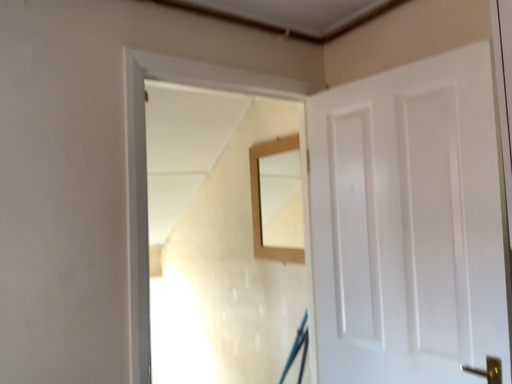
What is the approximate width of wooden frame at center?

The width of wooden frame at center is 5.06 inches.

Image resolution: width=512 pixels, height=384 pixels. I want to click on wooden mirror at center, so click(260, 199).

Find the location of `wooden frame at center`. wooden frame at center is located at coordinates (142, 131).

Between wooden mirror at center and wooden frame at center, which one has larger width?

With larger width is wooden frame at center.

At what (x,y) coordinates should I click in order to perform the action: click on window frame on the left of wooden mirror at center. Please return your answer as a coordinate pair (x, y). This screenshot has width=512, height=384. Looking at the image, I should click on (142, 131).

Is the depth of wooden mirror at center less than that of wooden frame at center?

That is False.

Is wooden mirror at center far from wooden frame at center?

That's not correct — wooden mirror at center is a little close to wooden frame at center.

Is wooden mirror at center situated inside white glossy door at right or outside?

wooden mirror at center is not enclosed by white glossy door at right.

Which object is closer to the camera taking this photo, wooden mirror at center or white glossy door at right?

Positioned in front is white glossy door at right.

In the scene shown: From the image's perspective, between wooden mirror at center and white glossy door at right, who is located below?

white glossy door at right.

Considering the relative sizes of wooden mirror at center and white glossy door at right in the image provided, is wooden mirror at center shorter than white glossy door at right?

Yes.

From a real-world perspective, is white glossy door at right physically located above or below wooden frame at center?

white glossy door at right is situated lower than wooden frame at center in the real world.

Would you say white glossy door at right is to the left or to the right of wooden frame at center in the picture?

Clearly, white glossy door at right is on the right of wooden frame at center in the image.

The image size is (512, 384). What are the coordinates of `window frame that is below the white glossy door at right (from the image's perspective)` in the screenshot? It's located at (142, 131).

Considering the points (361, 332) and (170, 80), which point is in front, point (361, 332) or point (170, 80)?

The point (170, 80) is closer.

From the image's perspective, between wooden frame at center and wooden mirror at center, who is located below?

wooden frame at center is shown below in the image.

From a real-world perspective, relative to wooden mirror at center, is wooden frame at center vertically above or below?

wooden frame at center is situated lower than wooden mirror at center in the real world.

How many degrees apart are the facing directions of wooden frame at center and wooden mirror at center?

90.8 degrees.

Does wooden frame at center have a smaller size compared to wooden mirror at center?

No, wooden frame at center is not smaller than wooden mirror at center.

Does point (129, 241) come behind point (396, 268)?

No.

From the image's perspective, is wooden frame at center located above or below white glossy door at right?

Clearly, from the image's perspective, wooden frame at center is below white glossy door at right.

Locate an element on the screen. This screenshot has width=512, height=384. door on the right of wooden frame at center is located at coordinates (408, 224).

Is wooden frame at center located outside white glossy door at right?

Yes, wooden frame at center is outside of white glossy door at right.

In the scene shown: Is there a large distance between white glossy door at right and wooden mirror at center?

white glossy door at right is actually quite close to wooden mirror at center.

How many degrees apart are the facing directions of white glossy door at right and wooden mirror at center?

They differ by 3.64 degrees in their facing directions.

From the image's perspective, would you say white glossy door at right is shown under wooden mirror at center?

Yes.

From a real-world perspective, is white glossy door at right over wooden mirror at center?

No, from a real-world perspective, white glossy door at right is not over wooden mirror at center

Identify the location of window frame that is in front of the wooden mirror at center. (142, 131).

Locate an element on the screen. Image resolution: width=512 pixels, height=384 pixels. mirror located above the white glossy door at right (from the image's perspective) is located at coordinates (260, 199).

Considering their positions, is wooden frame at center positioned closer to wooden mirror at center than white glossy door at right?

Based on the image, wooden frame at center appears to be nearer to wooden mirror at center.

Based on their spatial positions, is white glossy door at right or wooden frame at center closer to wooden mirror at center?

wooden frame at center is positioned closer to the anchor wooden mirror at center.

When comparing their distances from wooden frame at center, does white glossy door at right or wooden mirror at center seem closer?

Among the two, white glossy door at right is located nearer to wooden frame at center.

From the image, which object appears to be farther from white glossy door at right, wooden mirror at center or wooden frame at center?

wooden mirror at center.

In the scene shown: When comparing their distances from wooden frame at center, does wooden mirror at center or white glossy door at right seem closer?

white glossy door at right is positioned closer to the anchor wooden frame at center.

Estimate the real-world distances between objects in this image. Which object is closer to white glossy door at right, wooden frame at center or wooden mirror at center?

wooden frame at center.

Locate an element on the screen. Image resolution: width=512 pixels, height=384 pixels. window frame located between white glossy door at right and wooden mirror at center in the depth direction is located at coordinates (142, 131).